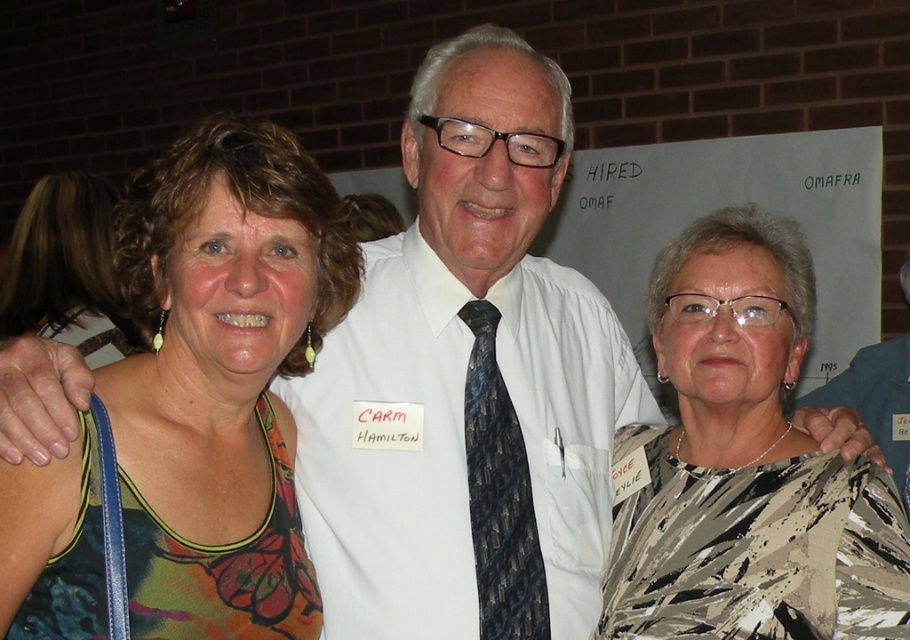
You are a photographer adjusting your camera settings. You notice two points in the image at coordinates point (67, 554) and point (89, 189). Which point should you focus on to ensure it appears sharper in the final photo?

Point (67, 554) is closer to the camera than point (89, 189), so focusing on point (67, 554) will result in a sharper image.

You are standing in front of the group photo and want to point out two specific points on the image. The first point is at coordinates point (135, 435) and the second is at point (847, 472). From your perspective, which point is closer to you?

Point (135, 435) is in front of point (847, 472), so it is closer to you.